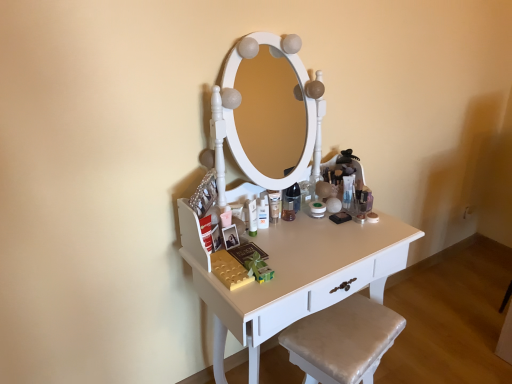
Question: Relative to translucent plastic tube at center, arranged as the 1th toiletry when viewed from the right, is white glossy table at center in front or behind?

Choices:
 (A) front
 (B) behind

Answer: (A)

Question: Looking at the image, does white glossy table at center seem bigger or smaller compared to translucent plastic tube at center, arranged as the second toiletry when viewed from the front?

Choices:
 (A) small
 (B) big

Answer: (B)

Question: Which of these objects is positioned farthest from the satin beige cushion at lower right?

Choices:
 (A) translucent plastic tube at center, arranged as the second toiletry when viewed from the front
 (B) matte white lotion at center, which is the first toiletry from left to right
 (C) white glossy table at center

Answer: (A)

Question: Estimate the real-world distances between objects in this image. Which object is farther from the white glossy table at center?

Choices:
 (A) translucent plastic tube at center, arranged as the 1th toiletry when viewed from the right
 (B) matte white lotion at center, the second toiletry from the right
 (C) satin beige cushion at lower right

Answer: (A)